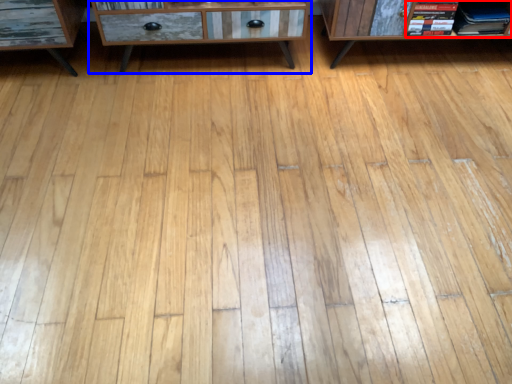
Question: Which point is closer to the camera, book (highlighted by a red box) or chest of drawers (highlighted by a blue box)?

Choices:
 (A) book
 (B) chest of drawers

Answer: (B)